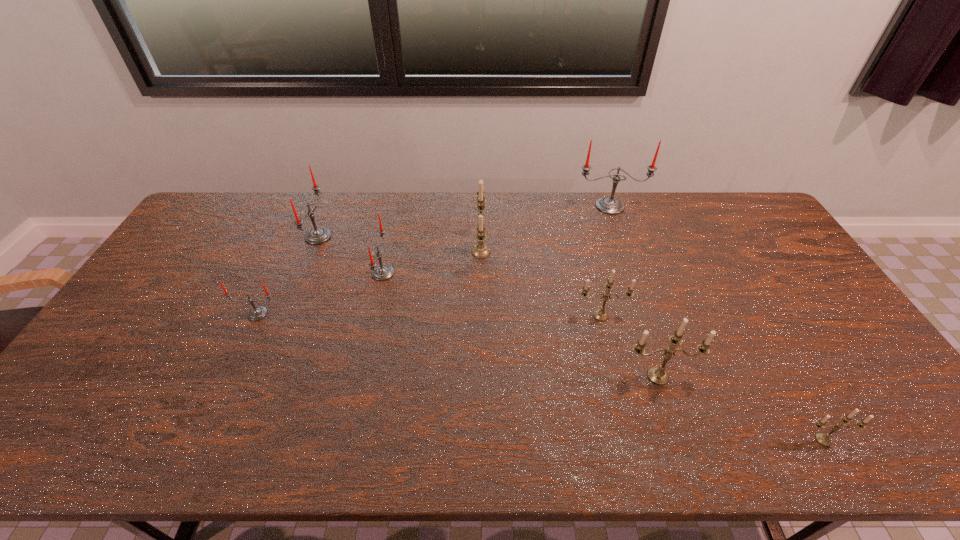
In order to click on free spot that satisfies the following two spatial constraints: 1. on the front-facing side of the third object from left to right; 2. on the front-facing side of the nearest red candle in this screenshot , I will do [x=373, y=314].

This screenshot has width=960, height=540. In order to click on blank space that satisfies the following two spatial constraints: 1. on the back side of the rightmost candle; 2. on the front-facing side of the second red candle from right to left in this screenshot , I will do `click(729, 273)`.